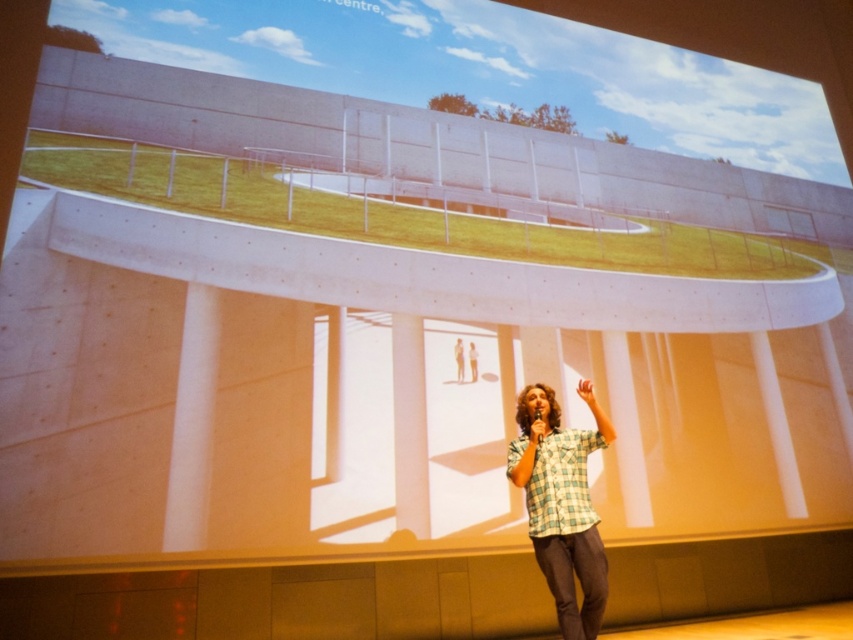
You are an event organizer who needs to order a new dress for the keynote speaker. The speaker is currently wearing a green plaid shirt at center and a light brown plaid shirt at center. Which shirt should you choose based on the speaker wearing it comfortably?

The green plaid shirt at center is larger in width than the light brown plaid shirt at center, so the speaker is more likely wearing the green plaid shirt at center comfortably.

You are an event organizer setting up a presentation. You need to ensure there is enough space between the green plaid shirt at center and the light brown plaid shirt at center for attendees to walk through. The required width for a walkway is 1.2 meters. Can the attendees comfortably walk between them?

The green plaid shirt at center is 1.40 meters from the light brown plaid shirt at center, which is wider than the required 1.2 meters. Attendees can comfortably walk between them.